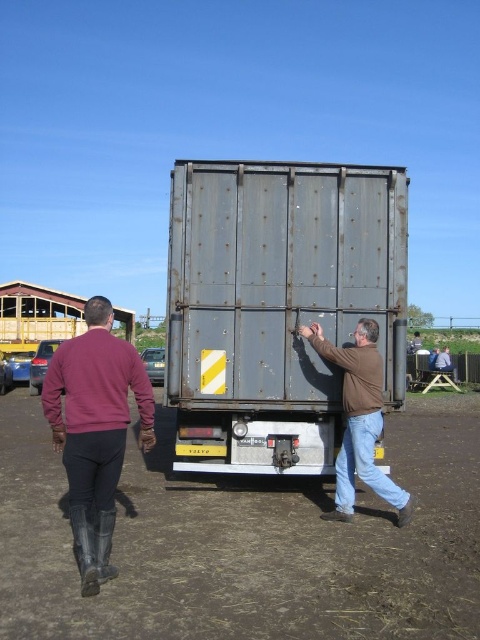
You are a delivery driver who needs to load a package onto the rusty metal trailer truck at center. You notice the brown matte jacket at center nearby. Can you determine if the jacket will fit inside the truck based on their sizes?

The rusty metal trailer truck at center is larger in size than the brown matte jacket at center, so the jacket will easily fit inside the truck.

You are standing at the origin of a coordinate system placed at the bottom left corner of the image. There are two points marked in the image. The first point is at coordinates point (331, 298) and the second point is at point (340, 513). If you were to walk from the first point to the second point, would you be moving towards the right or left direction?

Moving from point (331, 298) to point (340, 513) involves an increase in the x coordinate from 0.466 to 0.803, so you would be moving towards the right direction.

You are a photographer trying to capture a wide shot of the scene. Since the brown dirt field at center and the dark red sweater at left are both in the frame, which one would you focus on to ensure the entire subject fits within the photo?

The brown dirt field at center is larger in size than the dark red sweater at left, so focusing on the brown dirt field at center would ensure the entire subject fits within the photo.